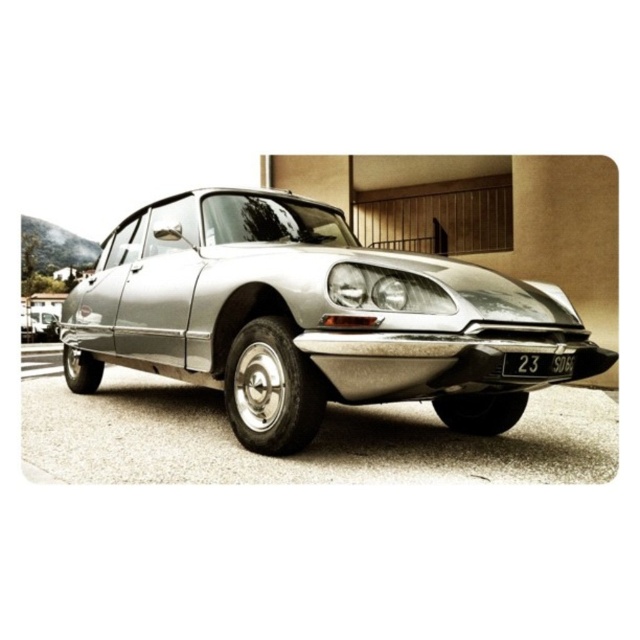
Which is below, silver metallic car at center or black plastic license plate at center?

black plastic license plate at center

You are a GUI agent. You are given a task and a screenshot of the screen. Output one action in this format:
    pyautogui.click(x=<x>, y=<y>)
    Task: Click on the silver metallic car at center
    The width and height of the screenshot is (640, 640).
    Given the screenshot: What is the action you would take?
    pyautogui.click(x=305, y=320)

Is silver metallic car at center smaller than satin chrome headlight at center?

No, silver metallic car at center is not smaller than satin chrome headlight at center.

Describe the element at coordinates (305, 320) in the screenshot. This screenshot has height=640, width=640. I see `silver metallic car at center` at that location.

Where is `silver metallic car at center`? The height and width of the screenshot is (640, 640). silver metallic car at center is located at coordinates tap(305, 320).

Can you confirm if satin chrome headlight at center is positioned to the right of shiny silver car at center?

Correct, you'll find satin chrome headlight at center to the right of shiny silver car at center.

Between point (387, 292) and point (56, 326), which one is positioned in front?

Point (387, 292)

Identify the location of satin chrome headlight at center. (385, 289).